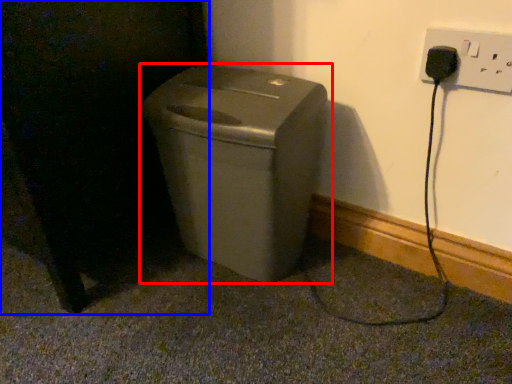
Question: Which object appears farthest to the camera in this image, waste container (highlighted by a red box) or dark (highlighted by a blue box)?

Choices:
 (A) waste container
 (B) dark

Answer: (A)